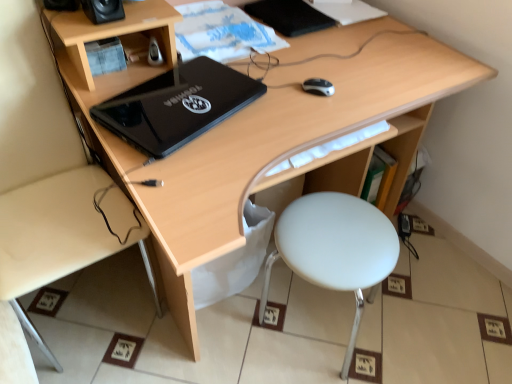
I want to click on free space above white plastic stool at lower right (from a real-world perspective), so click(x=335, y=241).